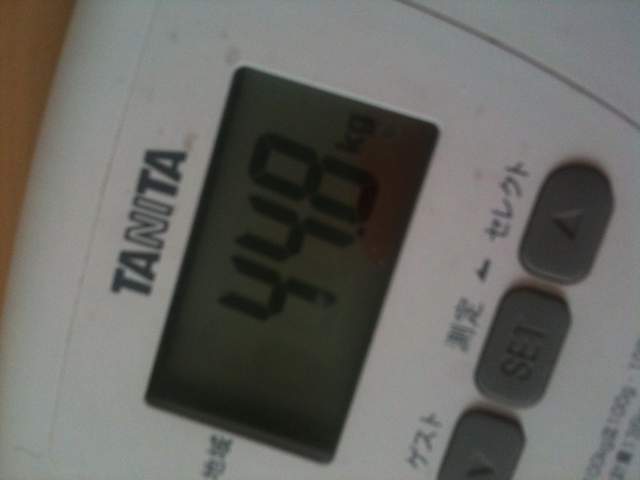
You are a GUI agent. You are given a task and a screenshot of the screen. Output one action in this format:
    pyautogui.click(x=<x>, y=<y>)
    Task: Click on the rectangular digital display screen
    
    Given the screenshot: What is the action you would take?
    coord(186,362)